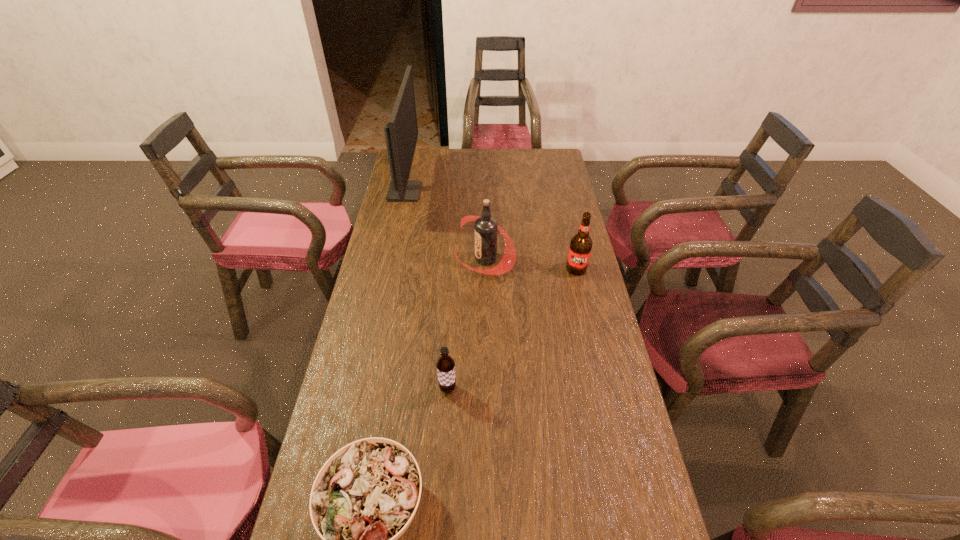
Image resolution: width=960 pixels, height=540 pixels. Identify the location of the tallest object. coord(401,133).

The height and width of the screenshot is (540, 960). Identify the location of the farthest object. (401, 133).

Identify the location of the rightmost root beer. (580, 248).

Identify the location of the nearest root beer. 445,364.

Where is `the fourth tallest object`? The image size is (960, 540). the fourth tallest object is located at coordinates (445, 364).

This screenshot has width=960, height=540. In order to click on blank space located on the front-facing side of the computer monitor in this screenshot , I will do `click(513, 192)`.

The height and width of the screenshot is (540, 960). I want to click on free space located 0.380m on the back of the rightmost root beer, so click(560, 199).

Identify the location of vacant point located 0.220m on the left of the second nearest object. The width and height of the screenshot is (960, 540). (354, 389).

The image size is (960, 540). In order to click on object situated at the far edge in this screenshot , I will do `click(401, 133)`.

This screenshot has width=960, height=540. What are the coordinates of `object that is at the left edge` in the screenshot? It's located at (401, 133).